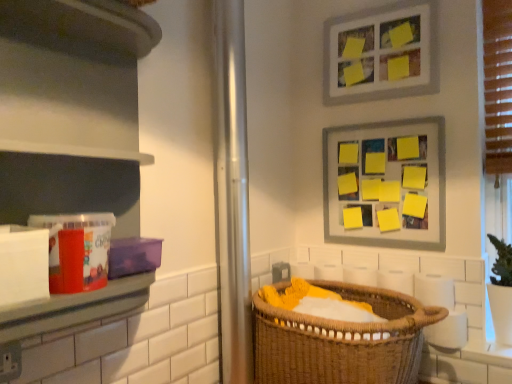
Question: Can you confirm if brown woven basket at lower center is shorter than yellow paper/magnetic board at upper right, marked as the second picture frame in a top-to-bottom arrangement?

Choices:
 (A) yes
 (B) no

Answer: (A)

Question: Is brown woven basket at lower center not inside yellow paper/magnetic board at upper right, which is the 1th picture frame from bottom to top?

Choices:
 (A) yes
 (B) no

Answer: (A)

Question: Considering the relative sizes of brown woven basket at lower center and yellow paper/magnetic board at upper right, marked as the second picture frame in a top-to-bottom arrangement, in the image provided, is brown woven basket at lower center smaller than yellow paper/magnetic board at upper right, marked as the second picture frame in a top-to-bottom arrangement,?

Choices:
 (A) yes
 (B) no

Answer: (B)

Question: Considering the relative sizes of brown woven basket at lower center and yellow paper/magnetic board at upper right, marked as the second picture frame in a top-to-bottom arrangement, in the image provided, is brown woven basket at lower center thinner than yellow paper/magnetic board at upper right, marked as the second picture frame in a top-to-bottom arrangement,?

Choices:
 (A) no
 (B) yes

Answer: (A)

Question: Does brown woven basket at lower center have a greater width compared to yellow paper/magnetic board at upper right, marked as the second picture frame in a top-to-bottom arrangement?

Choices:
 (A) yes
 (B) no

Answer: (A)

Question: From a real-world perspective, is brown woven basket at lower center below yellow paper/magnetic board at upper right, marked as the second picture frame in a top-to-bottom arrangement?

Choices:
 (A) yes
 (B) no

Answer: (A)

Question: Is matte plastic container at left bigger than yellow paper/magnetic board at upper right, which is the 1th picture frame from bottom to top?

Choices:
 (A) no
 (B) yes

Answer: (B)

Question: Does matte plastic container at left have a smaller size compared to yellow paper/magnetic board at upper right, which is the 1th picture frame from bottom to top?

Choices:
 (A) no
 (B) yes

Answer: (A)

Question: Is matte plastic container at left not inside yellow paper/magnetic board at upper right, marked as the second picture frame in a top-to-bottom arrangement?

Choices:
 (A) yes
 (B) no

Answer: (A)

Question: Could you tell me if matte plastic container at left is facing yellow paper/magnetic board at upper right, marked as the second picture frame in a top-to-bottom arrangement?

Choices:
 (A) no
 (B) yes

Answer: (A)

Question: Is yellow paper/magnetic board at upper right, marked as the second picture frame in a top-to-bottom arrangement, surrounded by matte plastic container at left?

Choices:
 (A) no
 (B) yes

Answer: (A)

Question: Is matte plastic container at left next to yellow paper/magnetic board at upper right, which is the 1th picture frame from bottom to top, and touching it?

Choices:
 (A) no
 (B) yes

Answer: (A)

Question: Considering the relative sizes of matte plastic container at left and metallic silver screen door at center in the image provided, is matte plastic container at left wider than metallic silver screen door at center?

Choices:
 (A) no
 (B) yes

Answer: (B)